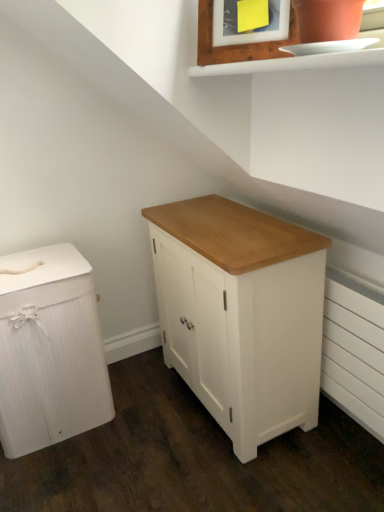
This screenshot has width=384, height=512. Find the location of `vacant space in white painted radiator at lower right (from a real-world perspective)`. vacant space in white painted radiator at lower right (from a real-world perspective) is located at coordinates (344, 436).